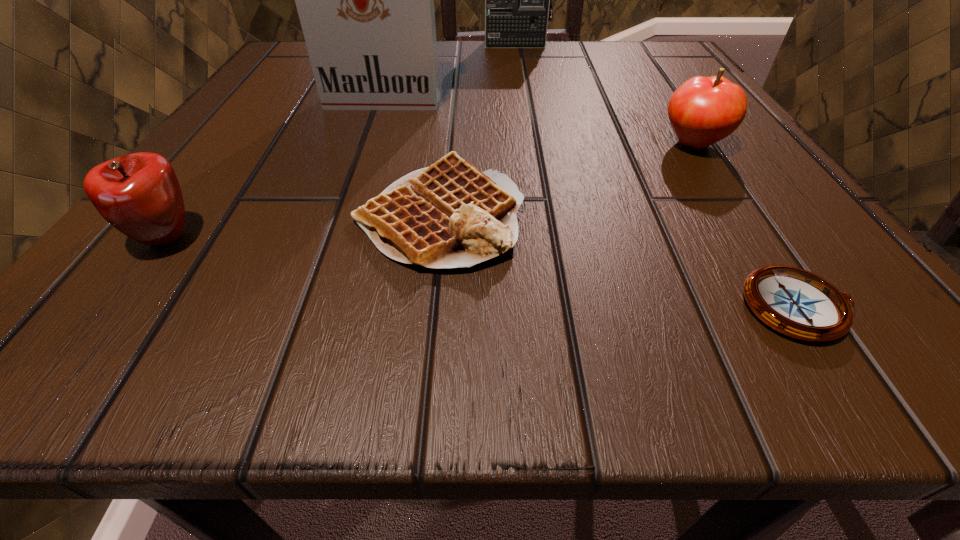
The height and width of the screenshot is (540, 960). I want to click on radio receiver, so click(x=518, y=0).

The width and height of the screenshot is (960, 540). I want to click on cigarette case, so click(x=365, y=0).

Locate an element on the screen. The height and width of the screenshot is (540, 960). the fourth nearest object is located at coordinates (704, 110).

Where is `the farther apple`? Image resolution: width=960 pixels, height=540 pixels. the farther apple is located at coordinates (704, 110).

This screenshot has height=540, width=960. In order to click on the left apple in this screenshot , I will do `click(139, 194)`.

You are a GUI agent. You are given a task and a screenshot of the screen. Output one action in this format:
    pyautogui.click(x=<x>, y=<y>)
    Task: Click on the leftmost object
    Image resolution: width=960 pixels, height=540 pixels.
    Given the screenshot: What is the action you would take?
    pyautogui.click(x=139, y=194)

Where is `waffle`? waffle is located at coordinates [x=448, y=215].

Where is `compass`? compass is located at coordinates (795, 302).

Identify the location of free space located 0.250m on the display of the farthest object. 525,107.

Where is `free space located with the lid open on the second farthest object`? The image size is (960, 540). free space located with the lid open on the second farthest object is located at coordinates (363, 159).